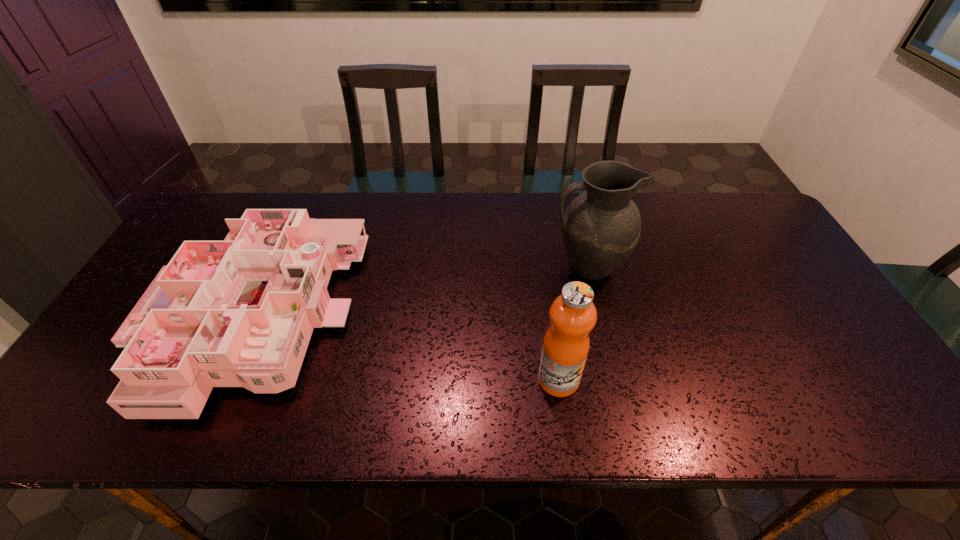
Where is `free space in the image that satisfies the following two spatial constraints: 1. at the front entrance of the fruit juice; 2. on the left side of the dollhouse`? free space in the image that satisfies the following two spatial constraints: 1. at the front entrance of the fruit juice; 2. on the left side of the dollhouse is located at coordinates (221, 380).

Find the location of `free region that satisfies the following two spatial constraints: 1. at the front entrance of the fruit juice; 2. on the right side of the leftmost object`. free region that satisfies the following two spatial constraints: 1. at the front entrance of the fruit juice; 2. on the right side of the leftmost object is located at coordinates (221, 380).

Find the location of a particular element. The image size is (960, 540). free space in the image that satisfies the following two spatial constraints: 1. at the front entrance of the fruit juice; 2. on the left side of the leftmost object is located at coordinates (221, 380).